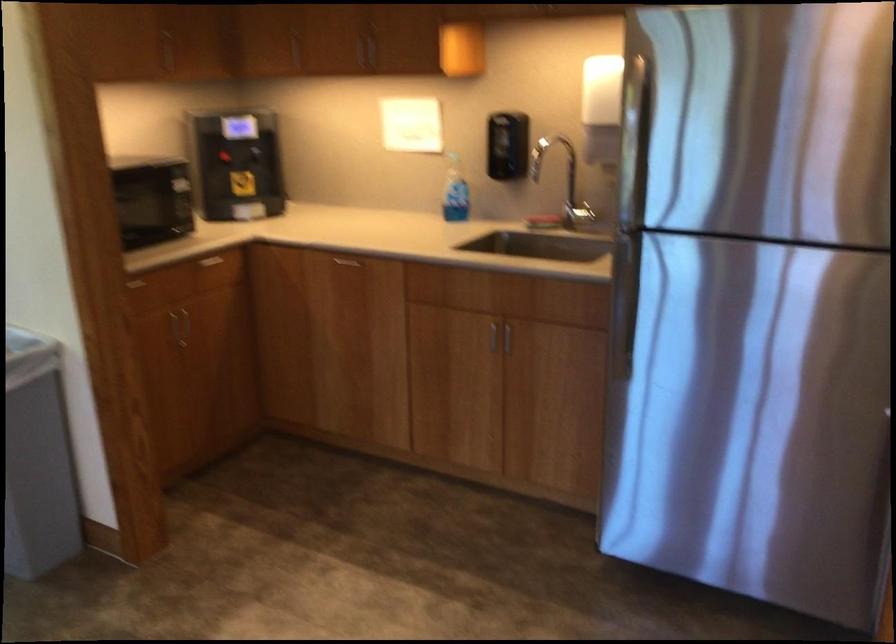
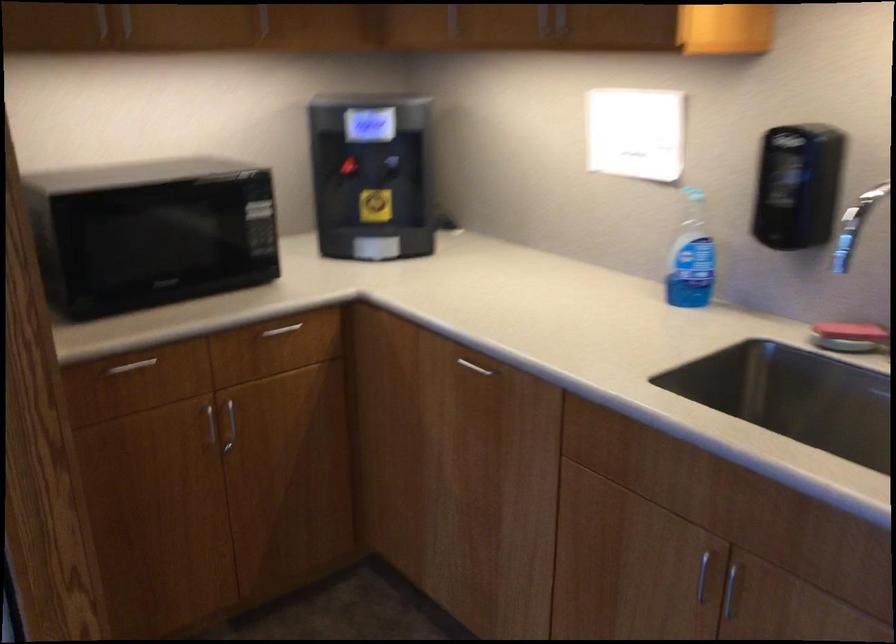
Question: What movement of the cameraman would produce the second image?

Choices:
 (A) Left
 (B) Right
 (C) Forward
 (D) Backward

Answer: (C)